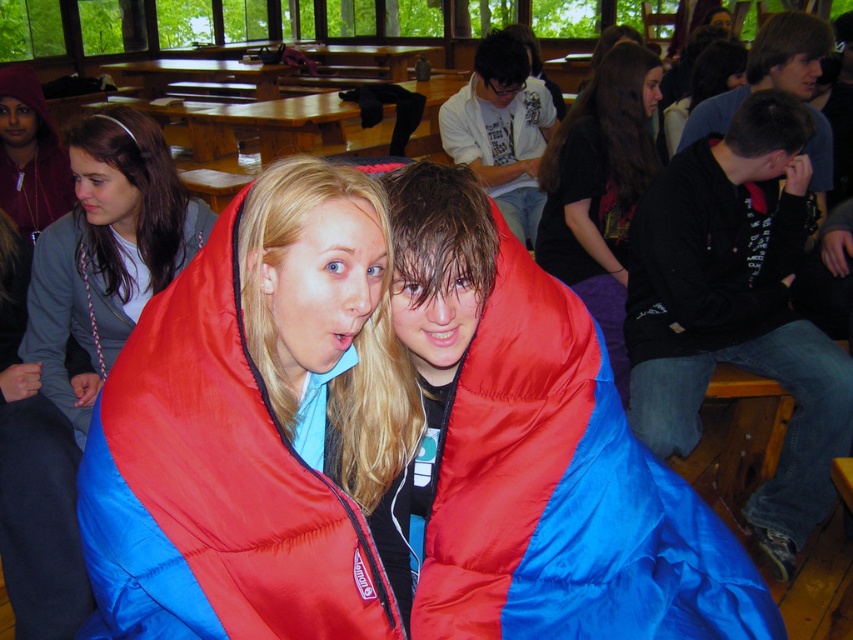
Can you confirm if dark blue fleece jacket at lower right is positioned below black fabric sleeping bag at center?

Yes, dark blue fleece jacket at lower right is below black fabric sleeping bag at center.

Between point (659, 349) and point (614, 45), which one is positioned in front?

Point (659, 349) is more forward.

Between point (683, 308) and point (630, 61), which one is positioned behind?

The point (630, 61) is more distant.

Locate an element on the screen. This screenshot has height=640, width=853. dark blue fleece jacket at lower right is located at coordinates (735, 310).

Is point (259, 465) positioned behind point (111, 264)?

That is False.

You are a GUI agent. You are given a task and a screenshot of the screen. Output one action in this format:
    pyautogui.click(x=<x>, y=<y>)
    Task: Click on the red nylon sleeping bag at center
    
    Given the screenshot: What is the action you would take?
    pyautogui.click(x=247, y=445)

Does white matte shirt at center appear on the left side of dark blue shirt at upper right?

Correct, you'll find white matte shirt at center to the left of dark blue shirt at upper right.

I want to click on white matte shirt at center, so click(x=502, y=129).

Does point (489, 177) lie behind point (796, 12)?

Yes, point (489, 177) is behind point (796, 12).

In order to click on white matte shirt at center in this screenshot , I will do `click(502, 129)`.